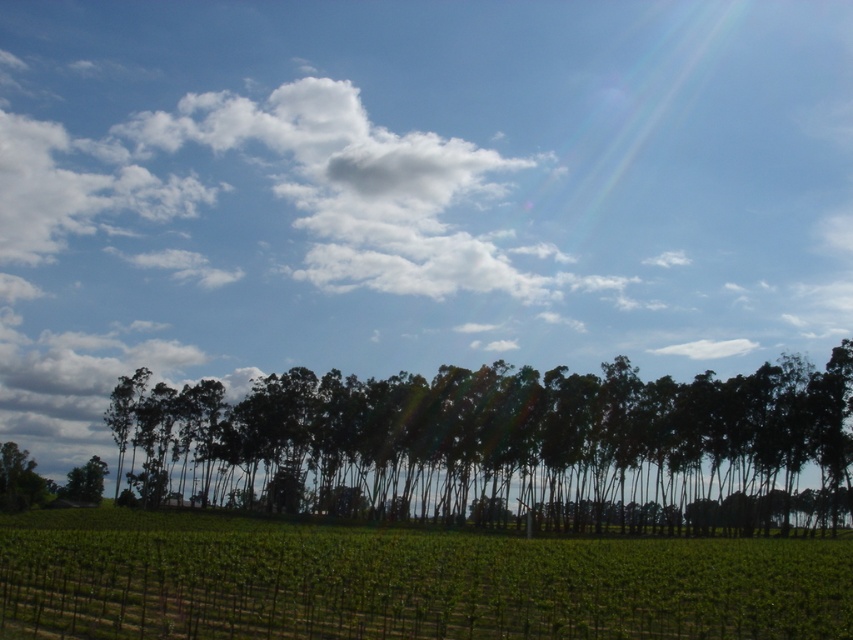
Question: Is dark green trees at center to the right of green leafy vineyard at center from the viewer's perspective?

Choices:
 (A) no
 (B) yes

Answer: (B)

Question: Does dark green trees at center appear on the right side of green leafy vineyard at center?

Choices:
 (A) no
 (B) yes

Answer: (B)

Question: Which of the following is the farthest from the observer?

Choices:
 (A) dark green trees at center
 (B) green leafy vineyard at center

Answer: (A)

Question: Which object appears farthest from the camera in this image?

Choices:
 (A) green leafy vineyard at center
 (B) dark green trees at center

Answer: (B)

Question: Among these objects, which one is farthest from the camera?

Choices:
 (A) green leafy vineyard at center
 (B) dark green trees at center

Answer: (B)

Question: Is dark green trees at center to the right of green leafy vineyard at center from the viewer's perspective?

Choices:
 (A) no
 (B) yes

Answer: (B)